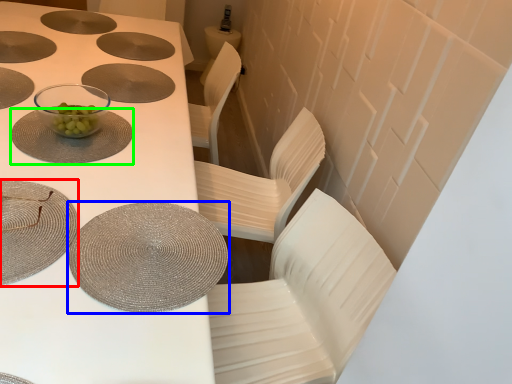
Question: Considering the real-world distances, which object is closest to tableware (highlighted by a red box)? tableware (highlighted by a blue box) or tableware (highlighted by a green box).

Choices:
 (A) tableware
 (B) tableware

Answer: (A)